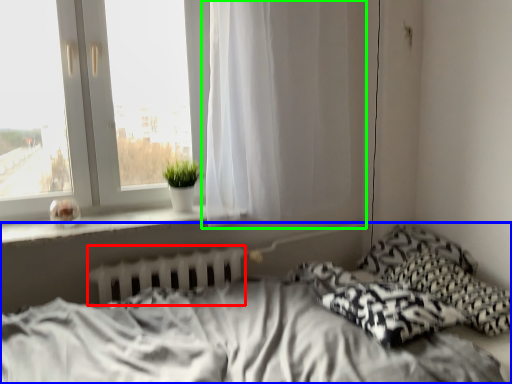
Question: Based on their relative distances, which object is farther from radiator (highlighted by a red box)? Choose from bed (highlighted by a blue box) and curtain (highlighted by a green box).

Choices:
 (A) bed
 (B) curtain

Answer: (B)